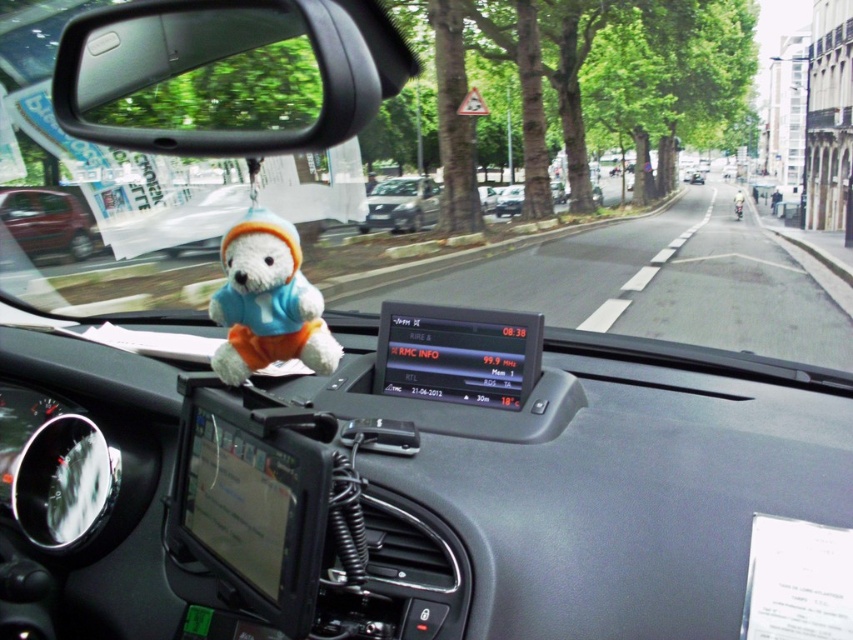
You are driving a car and looking through the windshield. You see a metallic red car at left and a metallic silver car at center. Which car is closer to you?

The metallic red car at left is closer to you because it is in front of the metallic silver car at center.

You are driving a car and notice two objects in your view. The transparent plastic view mirror at upper left and the satin silver car at center. Which object is closer to you?

The transparent plastic view mirror at upper left is closer to you because it is positioned in front of the satin silver car at center.